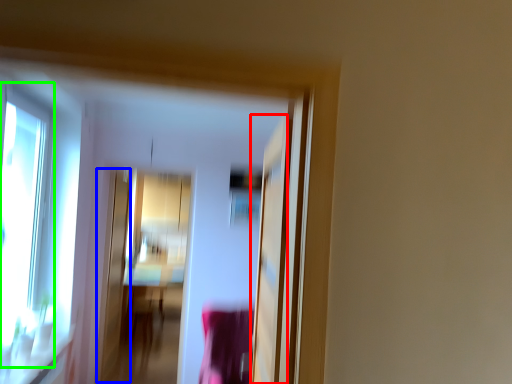
Question: Which object is the farthest from screen door (highlighted by a red box)? Choose among these: screen door (highlighted by a blue box) or window (highlighted by a green box).

Choices:
 (A) screen door
 (B) window

Answer: (A)